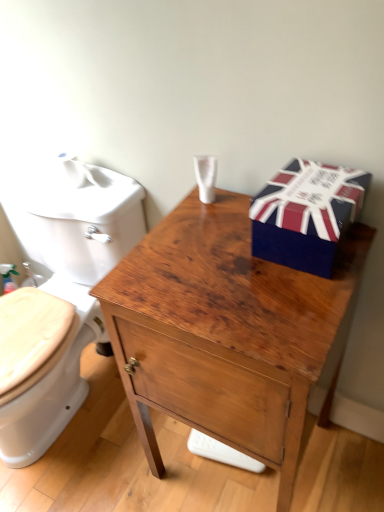
Question: Considering the relative sizes of wooden cabinet at center and white glossy toilet at left in the image provided, is wooden cabinet at center taller than white glossy toilet at left?

Choices:
 (A) yes
 (B) no

Answer: (A)

Question: Considering the relative positions of wooden cabinet at center and white glossy toilet at left in the image provided, is wooden cabinet at center to the right of white glossy toilet at left from the viewer's perspective?

Choices:
 (A) yes
 (B) no

Answer: (A)

Question: Is wooden cabinet at center at the left side of white glossy toilet at left?

Choices:
 (A) no
 (B) yes

Answer: (A)

Question: Is wooden cabinet at center closer to the viewer compared to white glossy toilet at left?

Choices:
 (A) no
 (B) yes

Answer: (B)

Question: Is wooden cabinet at center wider than white glossy toilet at left?

Choices:
 (A) yes
 (B) no

Answer: (B)

Question: From the image's perspective, is wooden cabinet at center below white glossy toilet at left?

Choices:
 (A) yes
 (B) no

Answer: (A)

Question: Is wooden cabinet at center shorter than union jack-patterned cardboard box at upper right?

Choices:
 (A) no
 (B) yes

Answer: (A)

Question: Can union jack-patterned cardboard box at upper right be found inside wooden cabinet at center?

Choices:
 (A) yes
 (B) no

Answer: (B)

Question: From a real-world perspective, is wooden cabinet at center under union jack-patterned cardboard box at upper right?

Choices:
 (A) no
 (B) yes

Answer: (B)

Question: Is wooden cabinet at center not near union jack-patterned cardboard box at upper right?

Choices:
 (A) no
 (B) yes

Answer: (A)

Question: Is wooden cabinet at center bigger than union jack-patterned cardboard box at upper right?

Choices:
 (A) no
 (B) yes

Answer: (B)

Question: Is wooden cabinet at center smaller than union jack-patterned cardboard box at upper right?

Choices:
 (A) yes
 (B) no

Answer: (B)

Question: Is white glossy toilet at left wider than union jack-patterned cardboard box at upper right?

Choices:
 (A) no
 (B) yes

Answer: (B)